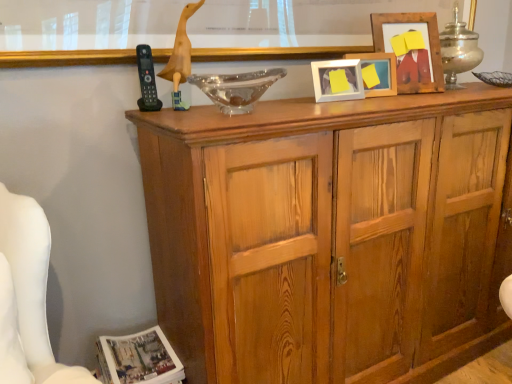
Question: Is white matte picture frame at upper center, arranged as the 1th picture frame when viewed from the left, situated inside wooden duck at upper center or outside?

Choices:
 (A) inside
 (B) outside

Answer: (B)

Question: Does point pos(326,84) appear closer or farther from the camera than point pos(186,104)?

Choices:
 (A) farther
 (B) closer

Answer: (A)

Question: Estimate the real-world distances between objects in this image. Which object is closer to the white matte picture frame at upper center, arranged as the 1th picture frame when viewed from the left?

Choices:
 (A) wooden duck at upper center
 (B) transparent glass bowl at center
 (C) yellow matte picture frame at upper center, which ranks as the 2th picture frame in left-to-right order
 (D) wooden picture frame at upper right, the 3th picture frame positioned from the left
 (E) wooden cabinet at center

Answer: (C)

Question: Which object is positioned closest to the transparent glass bowl at center?

Choices:
 (A) white glossy magazine at lower left
 (B) wooden duck at upper center
 (C) yellow matte picture frame at upper center, the second picture frame positioned from the right
 (D) wooden duck at upper center
 (E) wooden picture frame at upper right, the 3th picture frame positioned from the left

Answer: (B)